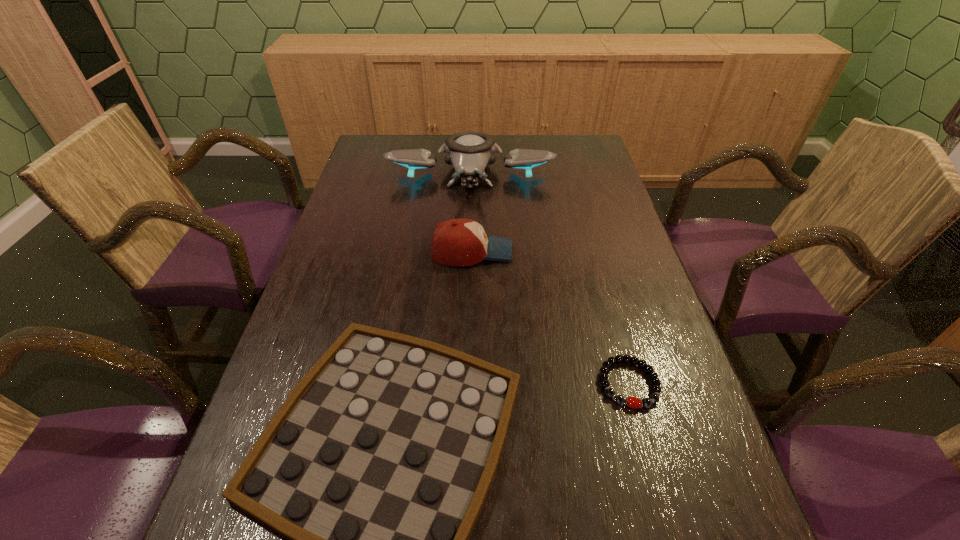
I want to click on unoccupied position between the bracelet and the second farthest object, so click(550, 318).

I want to click on free space between the bracelet and the second farthest object, so click(550, 318).

You are a GUI agent. You are given a task and a screenshot of the screen. Output one action in this format:
    pyautogui.click(x=<x>, y=<y>)
    Task: Click on the object that is the third nearest to the third nearest object
    
    Given the screenshot: What is the action you would take?
    pyautogui.click(x=632, y=402)

Choose which object is the nearest neighbor to the bracelet. Please provide its 2D coordinates. Your answer should be formatted as a tuple, i.e. [(x, y)], where the tuple contains the x and y coordinates of a point satisfying the conditions above.

[(376, 467)]

I want to click on vacant area that satisfies the following two spatial constraints: 1. on the front-facing side of the baseball cap; 2. on the left side of the bracelet, so click(x=468, y=383).

I want to click on free point that satisfies the following two spatial constraints: 1. on the front-facing side of the second farthest object; 2. on the right side of the shortest object, so click(x=468, y=383).

Find the location of a particular element. The width and height of the screenshot is (960, 540). vacant position in the image that satisfies the following two spatial constraints: 1. on the front-facing side of the farthest object; 2. on the right side of the bracelet is located at coordinates (464, 383).

Locate an element on the screen. This screenshot has height=540, width=960. blank space that satisfies the following two spatial constraints: 1. on the front-facing side of the shortest object; 2. on the right side of the baseball cap is located at coordinates (468, 383).

The height and width of the screenshot is (540, 960). What are the coordinates of `free space that satisfies the following two spatial constraints: 1. on the front-facing side of the drone; 2. on the left side of the bracelet` in the screenshot? It's located at (464, 383).